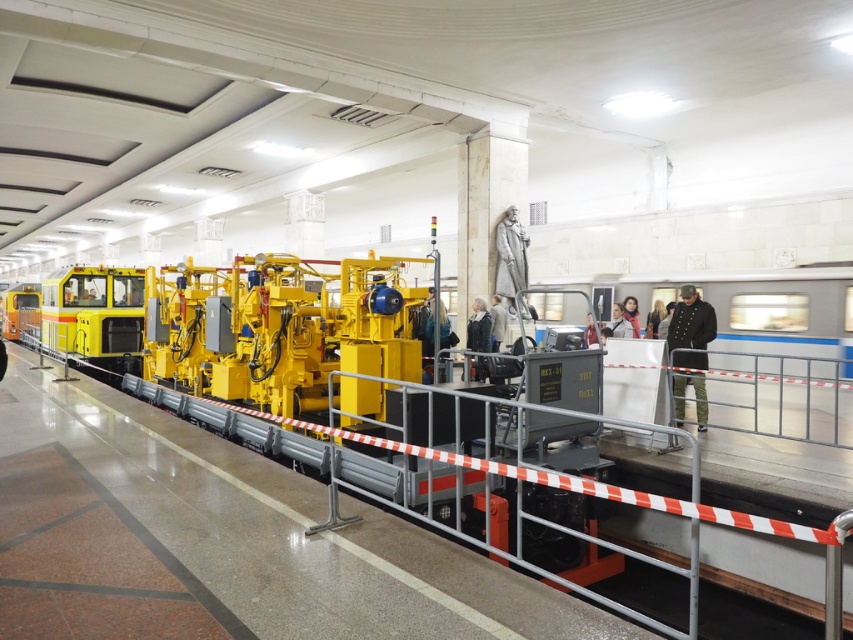
Question: Among these objects, which one is farthest from the camera?

Choices:
 (A) matte black scarf at center
 (B) dark gray suit at center
 (C) dark blue uniform at center
 (D) dark gray fabric coat at center

Answer: (C)

Question: Is dark green uniform at right to the left of dark gray suit at center from the viewer's perspective?

Choices:
 (A) no
 (B) yes

Answer: (A)

Question: Which of the following is the closest to the observer?

Choices:
 (A) (630, 323)
 (B) (660, 307)

Answer: (A)

Question: Which point appears closest to the camera in this image?

Choices:
 (A) (689, 301)
 (B) (497, 321)
 (C) (650, 324)

Answer: (A)

Question: Is dark green uniform at right in front of dark gray suit at center?

Choices:
 (A) yes
 (B) no

Answer: (A)

Question: Is dark gray fabric coat at center wider than dark gray suit at center?

Choices:
 (A) no
 (B) yes

Answer: (B)